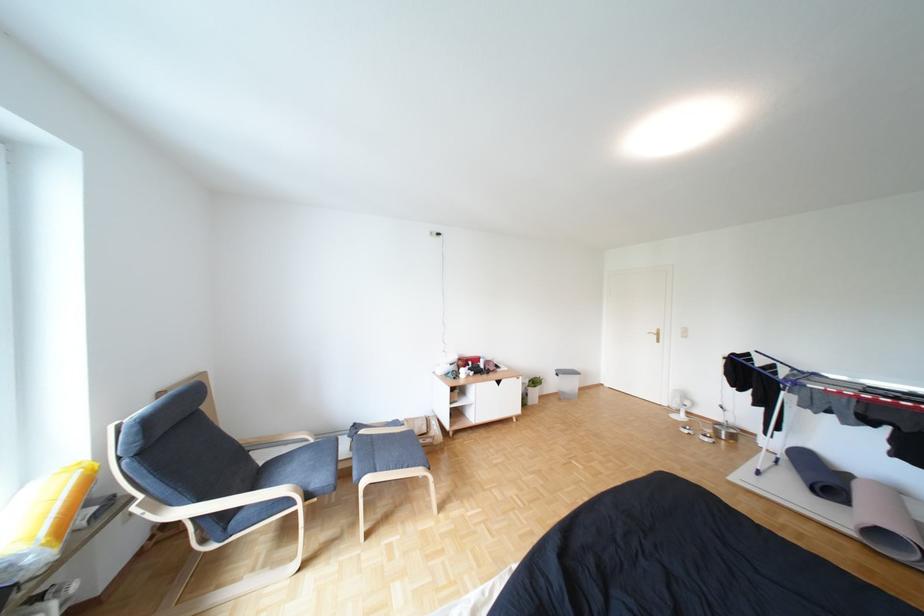
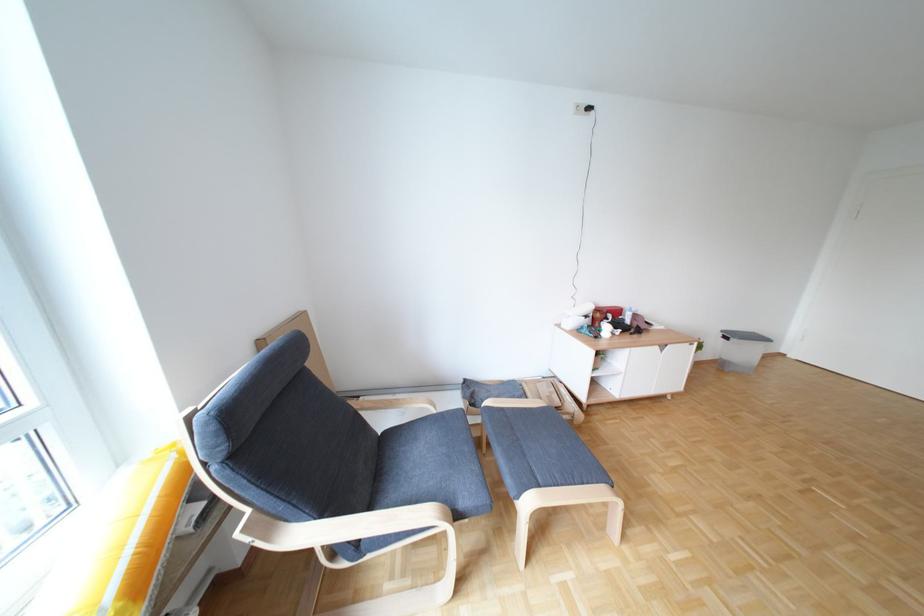
In the second image, find the point that corresponds to [489,406] in the first image.

(638, 377)